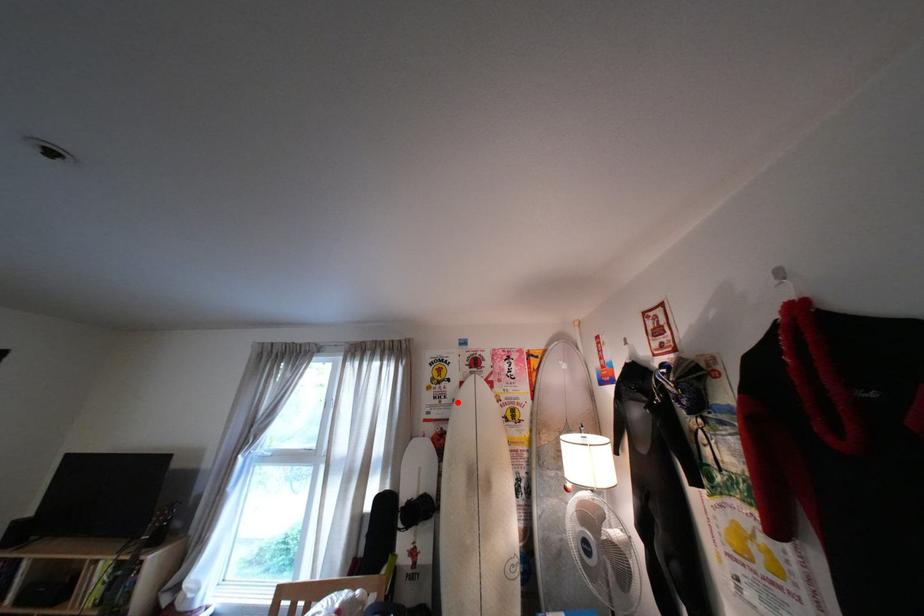
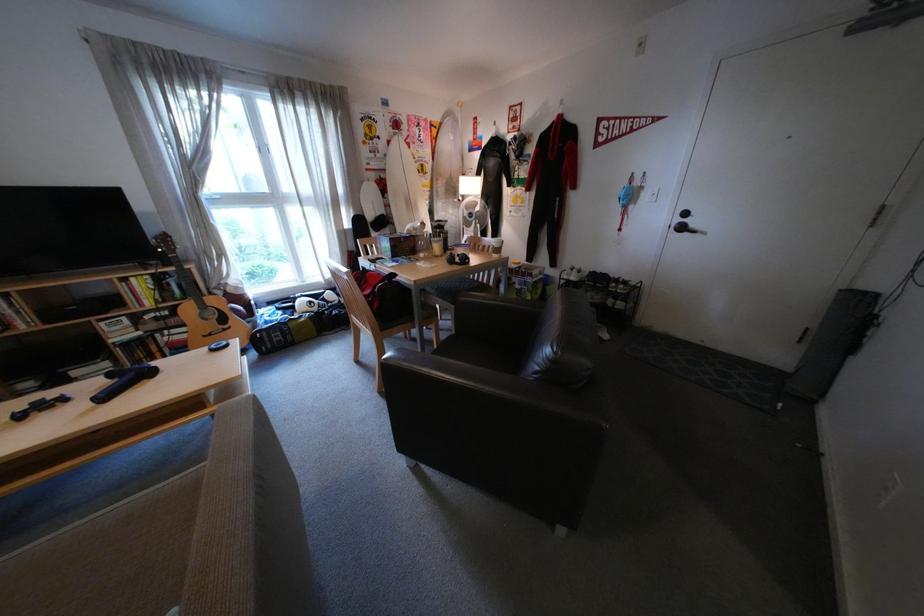
Question: I am providing you with two images of the same scene from different viewpoints. Image1 has a red point marked. In image2, the corresponding 3D location appears at what relative position? Reply with the corresponding letter.

Choices:
 (A) Closer
 (B) Farther

Answer: (A)